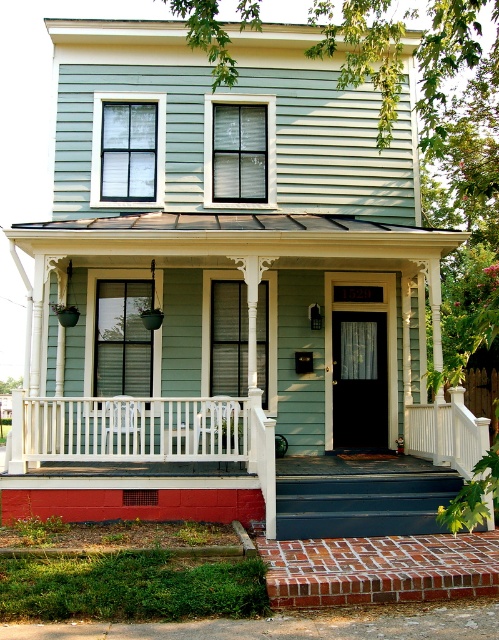
Is white painted wood porch at center below white painted wood railing at center?

Correct, white painted wood porch at center is located below white painted wood railing at center.

Who is taller, white painted wood porch at center or white painted wood railing at center?

white painted wood railing at center is taller.

Does point (115, 362) come in front of point (246, 401)?

That is False.

I want to click on white painted wood porch at center, so click(240, 368).

Does white painted wood porch at center appear on the left side of smooth white railing at center?

Correct, you'll find white painted wood porch at center to the left of smooth white railing at center.

Who is shorter, white painted wood porch at center or smooth white railing at center?

Standing shorter between the two is white painted wood porch at center.

The image size is (499, 640). I want to click on white painted wood porch at center, so click(x=240, y=368).

Based on the photo, can you confirm if smooth white railing at center is positioned below white painted wood railing at center?

Yes.

Does smooth white railing at center have a lesser width compared to white painted wood railing at center?

No, smooth white railing at center is not thinner than white painted wood railing at center.

Is point (167, 429) positioned after point (200, 458)?

Yes, point (167, 429) is behind point (200, 458).

At what (x,y) coordinates should I click in order to perform the action: click on smooth white railing at center. Please return your answer as a coordinate pair (x, y). Looking at the image, I should click on (145, 438).